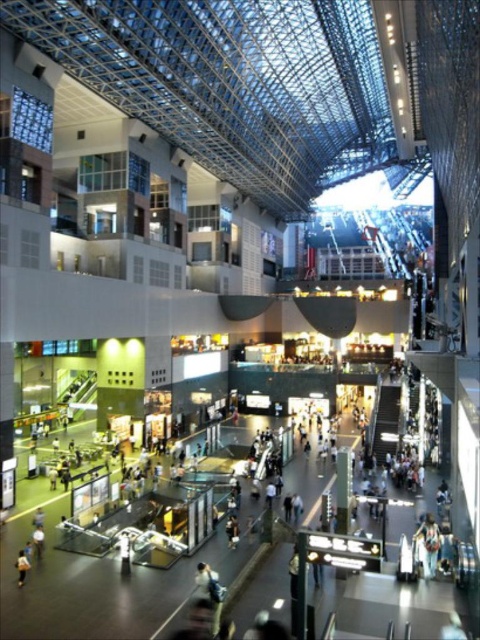
Question: Which object appears closest to the camera in this image?

Choices:
 (A) floral fabric dress at center
 (B) white fabric person at center
 (C) light brown leather jacket at lower left

Answer: (C)

Question: Is floral fabric dress at center to the right of white fabric person at center from the viewer's perspective?

Choices:
 (A) yes
 (B) no

Answer: (A)

Question: Does floral fabric dress at center come in front of white fabric person at center?

Choices:
 (A) no
 (B) yes

Answer: (B)

Question: Which of the following is the farthest from the observer?

Choices:
 (A) white fabric person at center
 (B) light brown leather jacket at lower left

Answer: (A)

Question: From the image, what is the correct spatial relationship of white fabric person at center in relation to light brown leather jacket at lower left?

Choices:
 (A) above
 (B) below

Answer: (B)

Question: Which of these objects is positioned closest to the white fabric person at center?

Choices:
 (A) floral fabric dress at center
 (B) light brown leather jacket at lower left

Answer: (B)